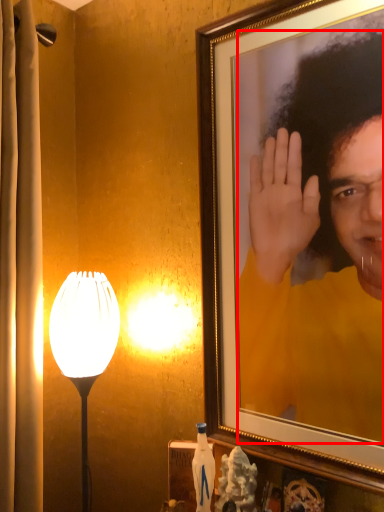
Question: Considering the relative positions of person (annotated by the red box) and lamp in the image provided, where is person (annotated by the red box) located with respect to the staircase?

Choices:
 (A) left
 (B) right

Answer: (B)